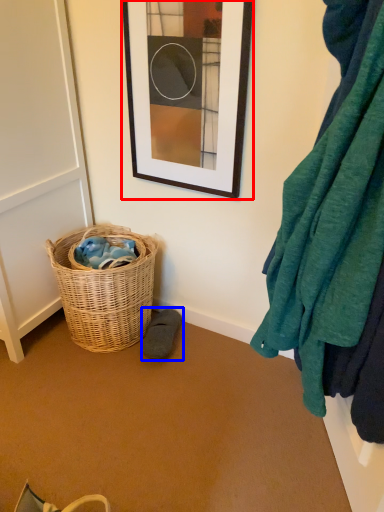
Question: Among these objects, which one is nearest to the camera, picture frame (highlighted by a red box) or shoe (highlighted by a blue box)?

Choices:
 (A) picture frame
 (B) shoe

Answer: (A)